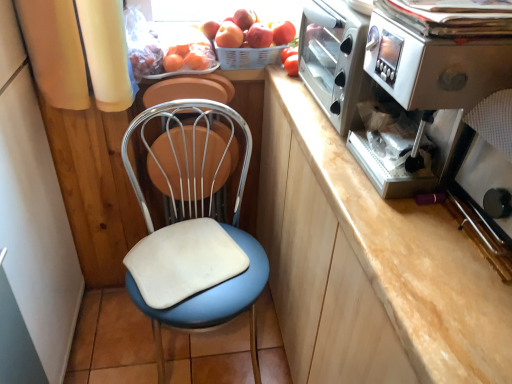
Question: Does satin silver coffee machine at right have a greater width compared to red matte apple at upper center, the 3th apple when ordered from left to right?

Choices:
 (A) no
 (B) yes

Answer: (B)

Question: Is satin silver coffee machine at right bigger than red matte apple at upper center, the 3th apple when ordered from left to right?

Choices:
 (A) no
 (B) yes

Answer: (B)

Question: Can you confirm if satin silver coffee machine at right is thinner than red matte apple at upper center, the 3th apple when ordered from left to right?

Choices:
 (A) no
 (B) yes

Answer: (A)

Question: Can red matte apple at upper center, placed as the 1th apple when sorted from right to left, be found inside satin silver coffee machine at right?

Choices:
 (A) yes
 (B) no

Answer: (B)

Question: Is satin silver coffee machine at right to the right of red matte apple at upper center, placed as the 1th apple when sorted from right to left, from the viewer's perspective?

Choices:
 (A) yes
 (B) no

Answer: (A)

Question: Is satin silver coffee machine at right positioned with its back to red matte apple at upper center, the 3th apple when ordered from left to right?

Choices:
 (A) yes
 (B) no

Answer: (B)

Question: Does red matte tomato at upper right have a smaller size compared to white leatherette chair at center?

Choices:
 (A) yes
 (B) no

Answer: (A)

Question: Is red matte tomato at upper right thinner than white leatherette chair at center?

Choices:
 (A) yes
 (B) no

Answer: (A)

Question: Does red matte tomato at upper right have a greater width compared to white leatherette chair at center?

Choices:
 (A) no
 (B) yes

Answer: (A)

Question: Is red matte tomato at upper right further to the viewer compared to white leatherette chair at center?

Choices:
 (A) yes
 (B) no

Answer: (A)

Question: Would you say red matte tomato at upper right is a long distance from white leatherette chair at center?

Choices:
 (A) no
 (B) yes

Answer: (A)

Question: Does red matte tomato at upper right have a lesser height compared to white leatherette chair at center?

Choices:
 (A) no
 (B) yes

Answer: (B)

Question: Does satin silver coffee machine at right appear on the left side of red matte apple at upper center, arranged as the 2th apple when viewed from the left?

Choices:
 (A) yes
 (B) no

Answer: (B)